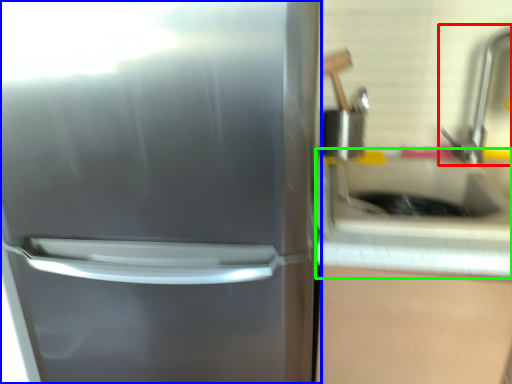
Question: Which object is positioned farthest from faucet (highlighted by a red box)? Select from refrigerator (highlighted by a blue box) and counter top (highlighted by a green box).

Choices:
 (A) refrigerator
 (B) counter top

Answer: (A)